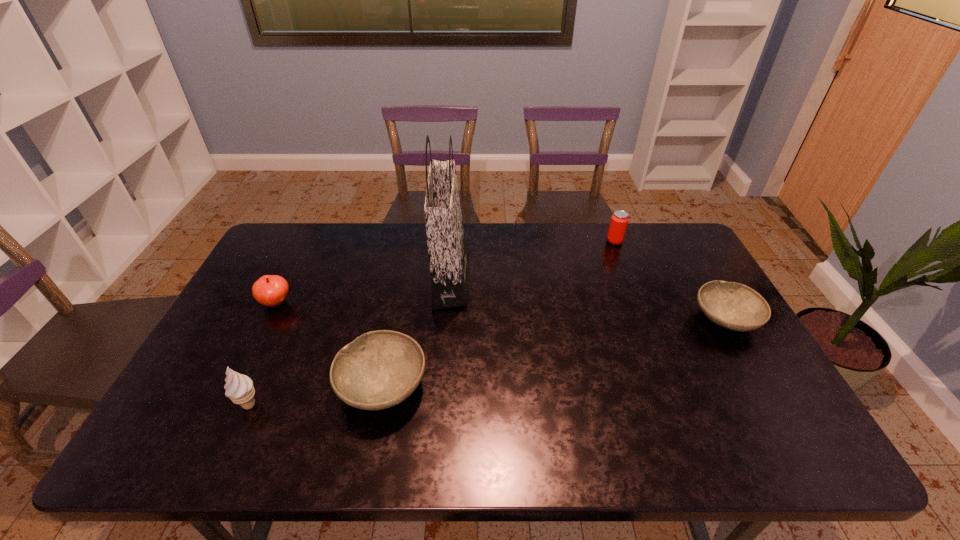
What are the coordinates of `free space located 0.090m on the left of the rightmost object` in the screenshot? It's located at (661, 319).

At what (x,y) coordinates should I click in order to perform the action: click on blank area located 0.270m on the back of the apple. Please return your answer as a coordinate pair (x, y). This screenshot has height=540, width=960. Looking at the image, I should click on (307, 240).

You are a GUI agent. You are given a task and a screenshot of the screen. Output one action in this format:
    pyautogui.click(x=<x>, y=<y>)
    Task: Click on the free space located on the right of the beer can
    
    Given the screenshot: What is the action you would take?
    pyautogui.click(x=680, y=241)

What are the coordinates of `free spot located on the front of the shopping bag with the design` in the screenshot? It's located at (493, 279).

Locate an element on the screen. The height and width of the screenshot is (540, 960). free region located 0.340m on the front-facing side of the fifth shortest object is located at coordinates (404, 405).

This screenshot has height=540, width=960. Identify the location of beer can that is at the far edge. (619, 220).

Where is `shopping bag that is at the far edge`? The width and height of the screenshot is (960, 540). shopping bag that is at the far edge is located at coordinates click(x=448, y=253).

Locate an element on the screen. The image size is (960, 540). bowl present at the near edge is located at coordinates (379, 369).

This screenshot has width=960, height=540. In order to click on icecream present at the near edge in this screenshot , I will do `click(239, 388)`.

What are the coordinates of `apple that is at the left edge` in the screenshot? It's located at (270, 290).